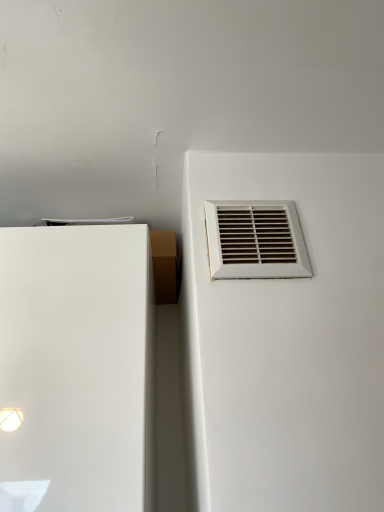
Find the location of a particular element. The width and height of the screenshot is (384, 512). white plastic vent at upper right is located at coordinates (255, 241).

What do you see at coordinates (255, 241) in the screenshot? I see `white plastic vent at upper right` at bounding box center [255, 241].

This screenshot has height=512, width=384. What are the coordinates of `white plastic vent at upper right` in the screenshot? It's located at (255, 241).